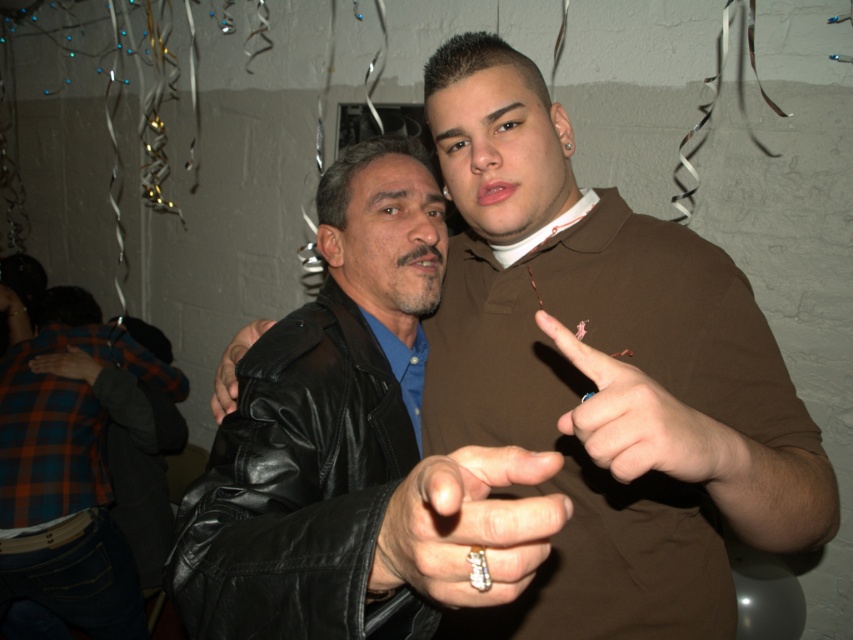
You are a photographer at a party and want to take a photo of the two people. You notice the smooth brown leather hand at center and the black leather jacket at left. Which object is closer to the right side of the frame?

The smooth brown leather hand at center is positioned on the right side of the black leather jacket at left, so it is closer to the right side of the frame.

You are at a party and see two black leather jackets in the image. Which one is taller, the black leather jacket at center or the black leather jacket at left?

The black leather jacket at center is taller than the black leather jacket at left according to the description.

You are a photographer trying to capture the perfect shot of the smooth brown leather hand at center. Where exactly should you position your camera to ensure it captures the hand in the frame?

Position your camera at point 0.661 on the x axis and 0.756 on the y axis to capture the smooth brown leather hand at center.